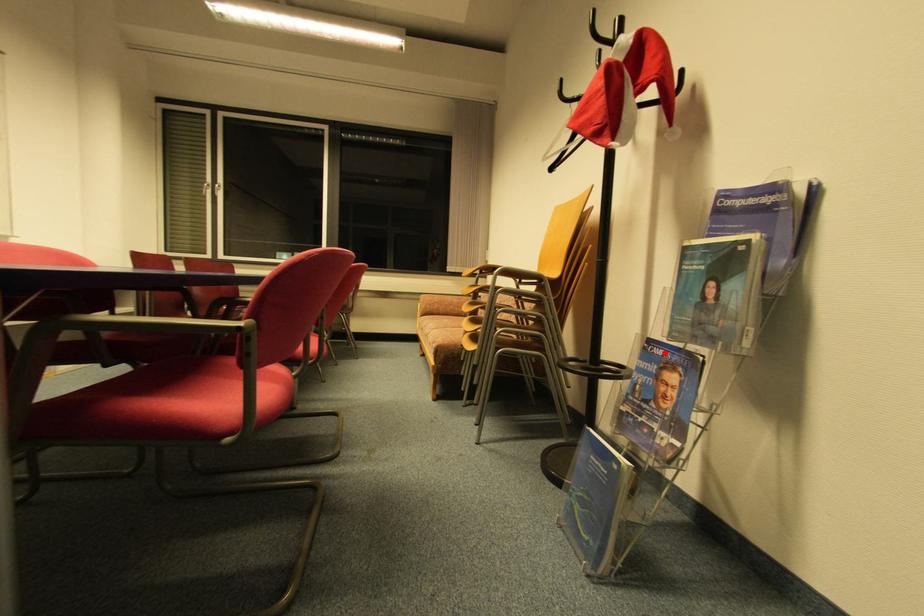
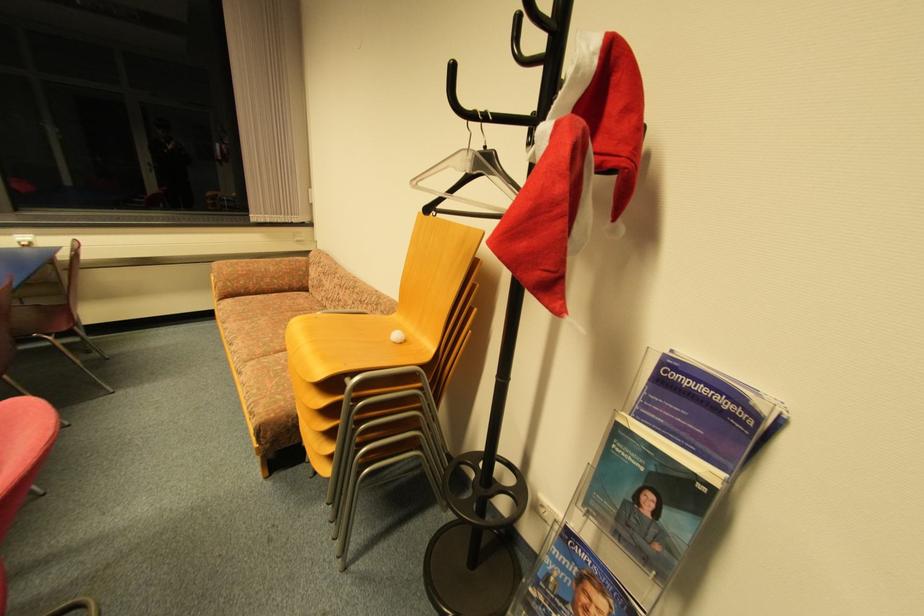
In the second image, find the point that corresponds to the highlighted location in the first image.

(588, 557)